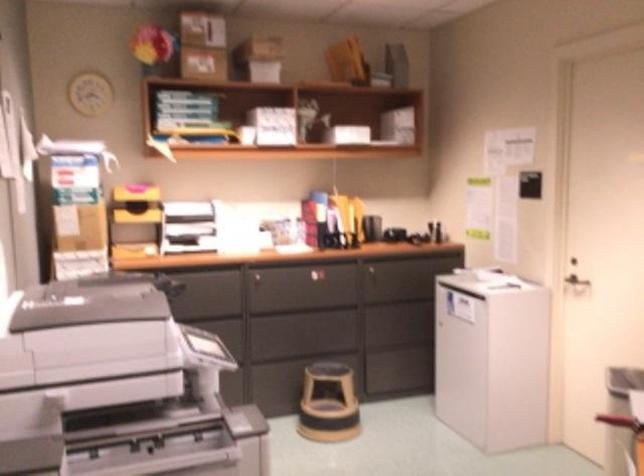
You are a GUI agent. You are given a task and a screenshot of the screen. Output one action in this format:
    pyautogui.click(x=<x>, y=<y>)
    Task: Click on the yellow paper tray
    
    Given the screenshot: What is the action you would take?
    pyautogui.click(x=348, y=214)